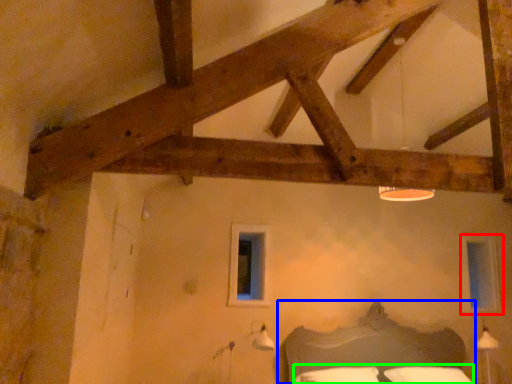
Question: Based on their relative distances, which object is farther from window (highlighted by a red box)? Choose from bed (highlighted by a blue box) and bedding (highlighted by a green box).

Choices:
 (A) bed
 (B) bedding

Answer: (B)